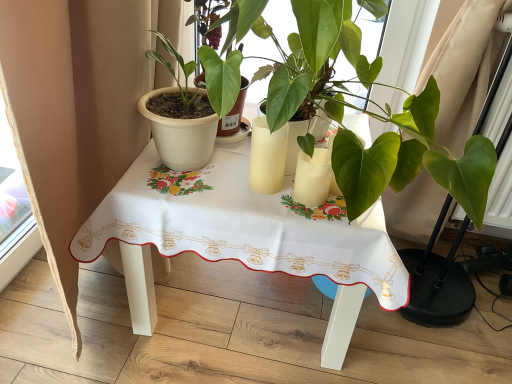
At what (x,y) coordinates should I click in order to perform the action: click on vacant region under matte white pot at left, the first houseplant viewed from the left (from a real-world perspective). Please return your answer as a coordinate pair (x, y). The image size is (512, 384). Looking at the image, I should click on pos(186,163).